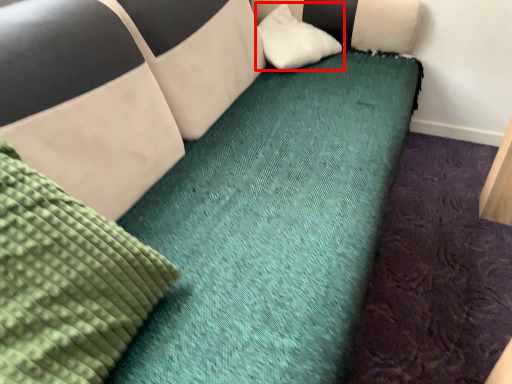
Question: From the image's perspective, what is the correct spatial positioning of pillow (annotated by the red box) in reference to mattress?

Choices:
 (A) above
 (B) below

Answer: (A)